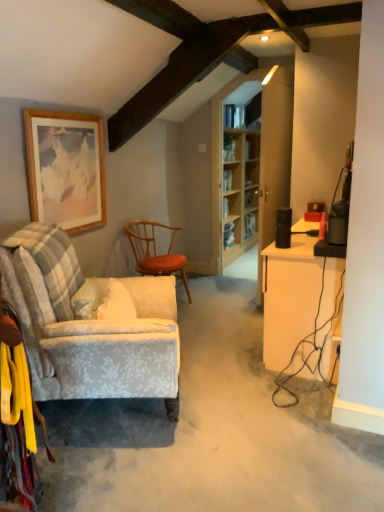
You are a GUI agent. You are given a task and a screenshot of the screen. Output one action in this format:
    pyautogui.click(x=<x>, y=<y>)
    Task: Click on the white glossy desk at right
    The image size is (384, 512).
    Given the screenshot: What is the action you would take?
    pyautogui.click(x=289, y=297)

The width and height of the screenshot is (384, 512). Find the location of `light blue fabric armchair at left, which ranks as the 1th chair in front-to-back order`. light blue fabric armchair at left, which ranks as the 1th chair in front-to-back order is located at coordinates (93, 327).

Looking at the image, does clear glass shelves at center seem bigger or smaller compared to wooden picture frame at upper left?

Clearly, clear glass shelves at center is smaller in size than wooden picture frame at upper left.

This screenshot has width=384, height=512. Find the location of `shelf located above the wooden picture frame at upper left (from a real-world perspective)`. shelf located above the wooden picture frame at upper left (from a real-world perspective) is located at coordinates (229, 148).

Measure the distance from wooden textured chair at center, the 1th chair when ordered from back to front, to light blue fabric armchair at left, which ranks as the 1th chair in front-to-back order.

A distance of 1.15 meters exists between wooden textured chair at center, the 1th chair when ordered from back to front, and light blue fabric armchair at left, which ranks as the 1th chair in front-to-back order.

In the scene shown: Who is smaller, wooden textured chair at center, which appears as the second chair when viewed from the front, or light blue fabric armchair at left, which is the second chair in back-to-front order?

With smaller size is wooden textured chair at center, which appears as the second chair when viewed from the front.

From a real-world perspective, is wooden textured chair at center, the 1th chair when ordered from back to front, over light blue fabric armchair at left, which ranks as the 1th chair in front-to-back order?

No, from a real-world perspective, wooden textured chair at center, the 1th chair when ordered from back to front, is not above light blue fabric armchair at left, which ranks as the 1th chair in front-to-back order.

Which object is thinner, wooden textured chair at center, which appears as the second chair when viewed from the front, or light blue fabric armchair at left, which is the second chair in back-to-front order?

With smaller width is wooden textured chair at center, which appears as the second chair when viewed from the front.

Would you say white glossy desk at right is inside or outside wooden picture frame at upper left?

The correct answer is: outside.

Is white glossy desk at right facing away from wooden picture frame at upper left?

white glossy desk at right is not turned away from wooden picture frame at upper left.

Locate an element on the screen. desk that is in front of the wooden picture frame at upper left is located at coordinates (289, 297).

Is white glossy desk at right not near wooden picture frame at upper left?

Yes, white glossy desk at right is far from wooden picture frame at upper left.

Starting from the clear glass shelves at center, which chair is the 2nd one in front? Please provide its 2D coordinates.

[(93, 327)]

Can you confirm if clear glass shelves at center is bigger than light blue fabric armchair at left, which is the second chair in back-to-front order?

Incorrect, clear glass shelves at center is not larger than light blue fabric armchair at left, which is the second chair in back-to-front order.

What's the angular difference between clear glass shelves at center and light blue fabric armchair at left, which is the second chair in back-to-front order,'s facing directions?

clear glass shelves at center and light blue fabric armchair at left, which is the second chair in back-to-front order, are facing 25.8 degrees away from each other.

Looking at this image, in the image, is clear glass shelves at center on the left side or the right side of light blue fabric armchair at left, which is the second chair in back-to-front order?

Based on their positions, clear glass shelves at center is located to the right of light blue fabric armchair at left, which is the second chair in back-to-front order.

From a real-world perspective, who is located higher, wooden picture frame at upper left or clear glass shelves at center?

In real-world perspective, clear glass shelves at center is above.

Where is `picture frame on the left of clear glass shelves at center`? This screenshot has width=384, height=512. picture frame on the left of clear glass shelves at center is located at coordinates (66, 168).

Which is farther from the camera, (83, 165) or (225, 142)?

Positioned behind is point (225, 142).

Is white glossy desk at right positioned with its back to clear glass shelves at center?

No, white glossy desk at right is not facing away from clear glass shelves at center.

Is white glossy desk at right to the right of clear glass shelves at center from the viewer's perspective?

Yes, white glossy desk at right is to the right of clear glass shelves at center.

Considering the sizes of objects white glossy desk at right and clear glass shelves at center in the image provided, who is thinner, white glossy desk at right or clear glass shelves at center?

clear glass shelves at center.

Is white glossy desk at right situated inside clear glass shelves at center or outside?

white glossy desk at right is not enclosed by clear glass shelves at center.

Which object is further away from the camera taking this photo, clear glass shelves at center or wooden textured chair at center, the 1th chair when ordered from back to front?

clear glass shelves at center.

Is clear glass shelves at center facing towards wooden textured chair at center, the 1th chair when ordered from back to front?

No, clear glass shelves at center is not oriented towards wooden textured chair at center, the 1th chair when ordered from back to front.

In the scene shown: Is clear glass shelves at center inside the boundaries of wooden textured chair at center, which appears as the second chair when viewed from the front, or outside?

clear glass shelves at center is located beyond the bounds of wooden textured chair at center, which appears as the second chair when viewed from the front.

I want to click on shelf located above the wooden picture frame at upper left (from a real-world perspective), so click(229, 148).

I want to click on chair that is below the wooden textured chair at center, the 1th chair when ordered from back to front (from the image's perspective), so click(x=93, y=327).

Estimate the real-world distances between objects in this image. Which object is further from clear glass shelves at center, wooden textured chair at center, the 1th chair when ordered from back to front, or light blue fabric armchair at left, which is the second chair in back-to-front order?

light blue fabric armchair at left, which is the second chair in back-to-front order, is positioned further to the anchor clear glass shelves at center.

From the image, which object appears to be nearer to wooden textured chair at center, which appears as the second chair when viewed from the front, light blue fabric armchair at left, which ranks as the 1th chair in front-to-back order, or clear glass shelves at center?

light blue fabric armchair at left, which ranks as the 1th chair in front-to-back order, lies closer to wooden textured chair at center, which appears as the second chair when viewed from the front, than the other object.

Estimate the real-world distances between objects in this image. Which object is closer to light blue fabric armchair at left, which is the second chair in back-to-front order, clear glass shelves at center or wooden picture frame at upper left?

wooden picture frame at upper left is positioned closer to the anchor light blue fabric armchair at left, which is the second chair in back-to-front order.

Based on their spatial positions, is white glossy desk at right or clear glass shelves at center further from light blue fabric armchair at left, which is the second chair in back-to-front order?

clear glass shelves at center.

Based on their spatial positions, is light blue fabric armchair at left, which is the second chair in back-to-front order, or wooden picture frame at upper left further from wooden textured chair at center, the 1th chair when ordered from back to front?

Among the two, light blue fabric armchair at left, which is the second chair in back-to-front order, is located further to wooden textured chair at center, the 1th chair when ordered from back to front.

When comparing their distances from wooden picture frame at upper left, does light blue fabric armchair at left, which is the second chair in back-to-front order, or wooden textured chair at center, the 1th chair when ordered from back to front, seem further?

wooden textured chair at center, the 1th chair when ordered from back to front, is positioned further to the anchor wooden picture frame at upper left.

Looking at the image, which one is located further to light blue fabric armchair at left, which is the second chair in back-to-front order, wooden picture frame at upper left or white glossy desk at right?

Based on the image, white glossy desk at right appears to be further to light blue fabric armchair at left, which is the second chair in back-to-front order.

Looking at the image, which one is located further to light blue fabric armchair at left, which ranks as the 1th chair in front-to-back order, white glossy desk at right or wooden textured chair at center, the 1th chair when ordered from back to front?

Among the two, wooden textured chair at center, the 1th chair when ordered from back to front, is located further to light blue fabric armchair at left, which ranks as the 1th chair in front-to-back order.

Locate an element on the screen. chair between light blue fabric armchair at left, which ranks as the 1th chair in front-to-back order, and clear glass shelves at center, along the z-axis is located at coordinates (155, 251).

Find the location of a particular element. picture frame between light blue fabric armchair at left, which is the second chair in back-to-front order, and wooden textured chair at center, the 1th chair when ordered from back to front, in the front-back direction is located at coordinates (66, 168).

Identify the location of chair located between light blue fabric armchair at left, which ranks as the 1th chair in front-to-back order, and white glossy desk at right in the left-right direction. This screenshot has height=512, width=384. (155, 251).

The width and height of the screenshot is (384, 512). Find the location of `chair between wooden picture frame at upper left and clear glass shelves at center from front to back`. chair between wooden picture frame at upper left and clear glass shelves at center from front to back is located at coordinates (155, 251).